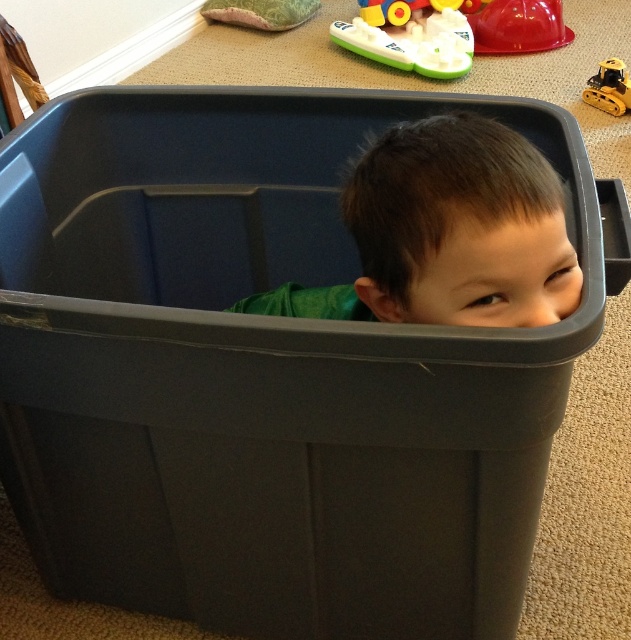
You are a parent looking for your child in a playroom. You see the green plastic boat at upper center and the shiny plastic bowl at upper right. Which object is closer to the ceiling?

The green plastic boat at upper center is taller than the shiny plastic bowl at upper right, so it is closer to the ceiling.

You are a parent looking for your child in a playroom. You see the dark green hair at upper center and the yellow plastic toy at upper center. Which object is closer to the top of the frame?

The yellow plastic toy at upper center is closer to the top of the frame because the dark green hair at upper center is positioned under it.

You are a parent trying to locate the green plastic boat at upper center in the playroom. According to the coordinates provided, where should you look relative to the other objects in the image?

The green plastic boat at upper center is located at coordinates point (410, 40), which places it near the top left corner of the frame, close to the small patterned pillow mentioned in the scene description.